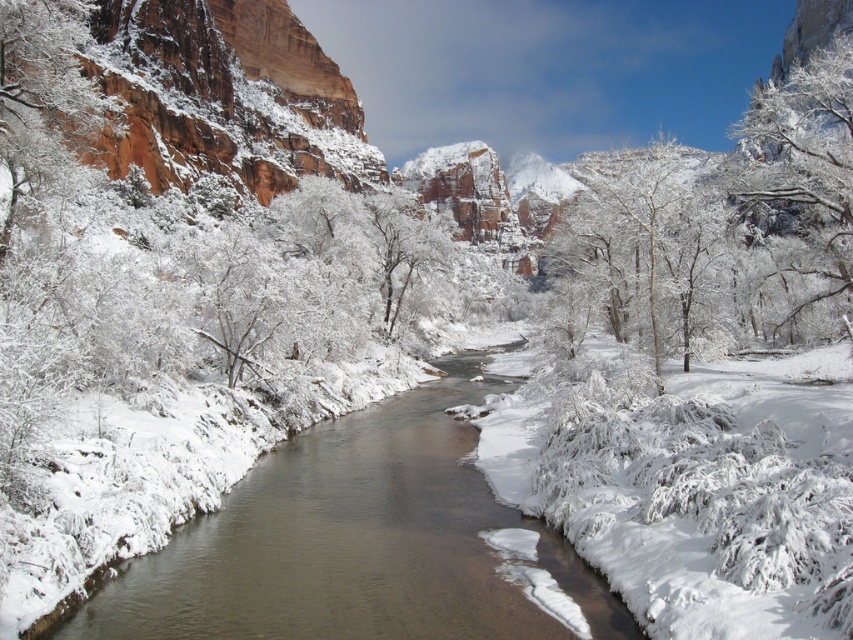
You are standing at the center of the image and want to locate the white frosty tree at center. Which direction should you look to find it?

The white frosty tree at center is located at point coordinates of [646,248], so you should look slightly to the left and downward from the very center of the image.

Based on the photo, you are an explorer trying to cross the brown smooth stream at center. You notice the white frosty branches at upper right. Which object is closer to you as you stand at the riverbank?

The brown smooth stream at center is closer to you because it is in front of the white frosty branches at upper right.